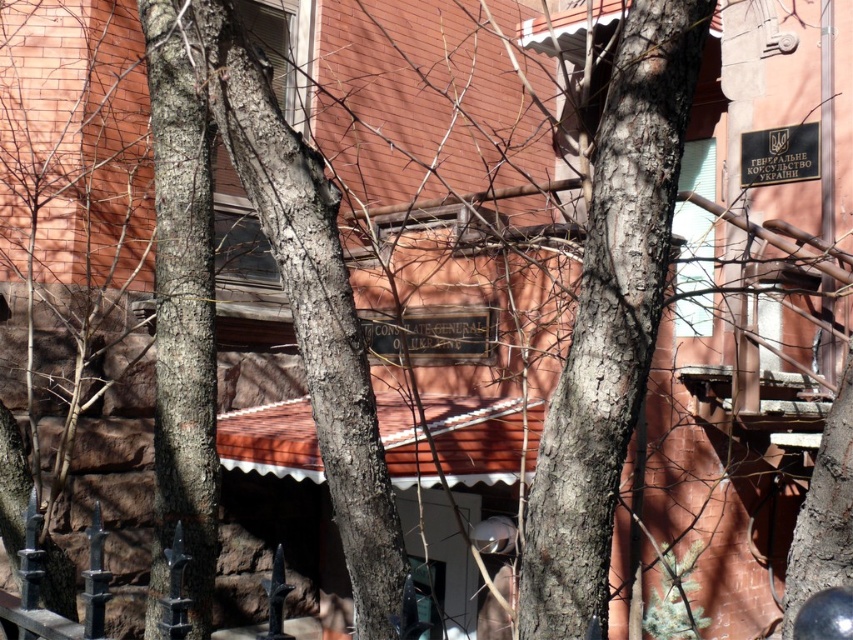
You are standing in front of the building and notice the smooth bark tree at center. Based on its position, can you determine if it is directly in front of the consulate building?

The smooth bark tree at center is located at point (610, 317), which places it directly in front of the consulate building.

You are standing in front of the consulate building and notice two points marked on the wall. The first point is at coordinate point (612, 257) and the second is at point (814, 131). Which point is closer to you?

Point (612, 257) is in front of point (814, 131), so it is closer to you.